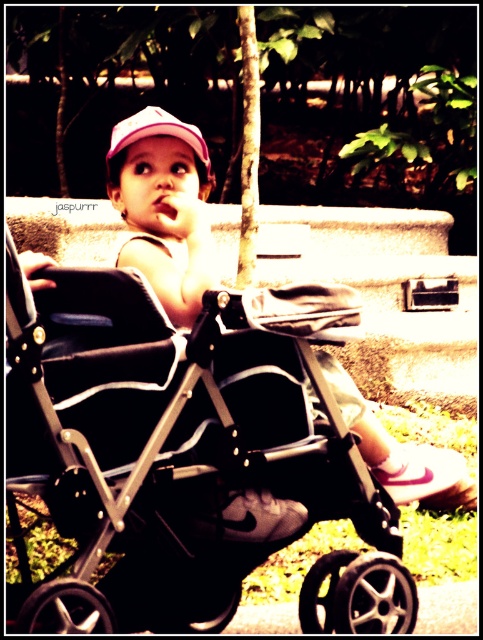
Is point (54, 625) farther from viewer compared to point (144, 118)?

No.

I want to click on black matte baby carriage at center, so click(184, 456).

Where is `black matte baby carriage at center`? This screenshot has height=640, width=483. black matte baby carriage at center is located at coordinates (184, 456).

In the scene shown: Is pink fabric toddler at center to the left of pink fabric cap at upper center from the viewer's perspective?

Incorrect, pink fabric toddler at center is not on the left side of pink fabric cap at upper center.

Can you confirm if pink fabric toddler at center is bigger than pink fabric cap at upper center?

Indeed, pink fabric toddler at center has a larger size compared to pink fabric cap at upper center.

Locate an element on the screen. This screenshot has width=483, height=640. pink fabric toddler at center is located at coordinates (166, 221).

Between black matte baby carriage at center and pink fabric toddler at center, which one appears on the left side from the viewer's perspective?

From the viewer's perspective, black matte baby carriage at center appears more on the left side.

Does point (304, 326) lie in front of point (148, 259)?

That is True.

This screenshot has width=483, height=640. I want to click on black matte baby carriage at center, so click(x=184, y=456).